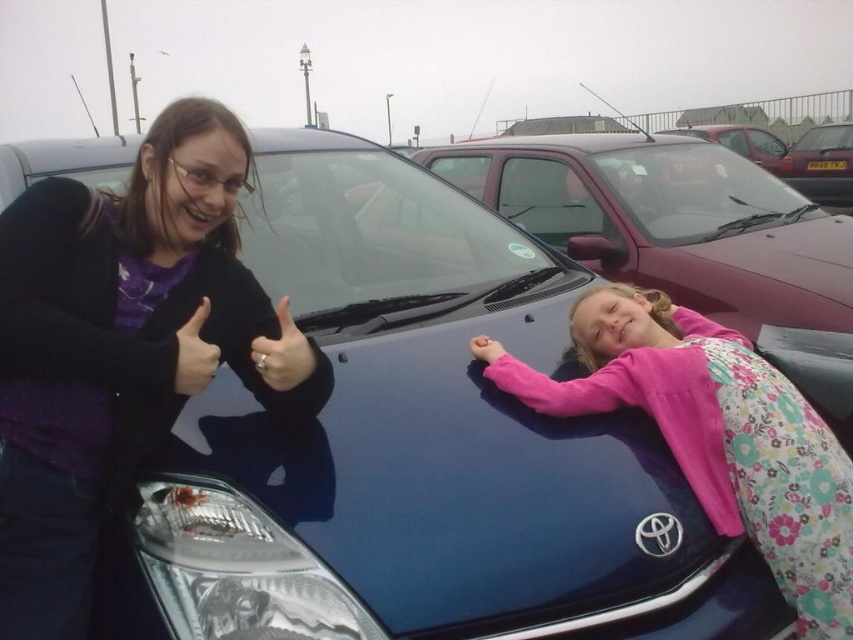
Who is lower down, matte black jacket at left or pink floral dress at center?

pink floral dress at center is below.

Can you confirm if matte black jacket at left is positioned below pink floral dress at center?

No, matte black jacket at left is not below pink floral dress at center.

This screenshot has height=640, width=853. Describe the element at coordinates (114, 346) in the screenshot. I see `matte black jacket at left` at that location.

Locate an element on the screen. matte black jacket at left is located at coordinates (114, 346).

Is matte black jacket at left bigger than metallic maroon car at right?

Actually, matte black jacket at left might be smaller than metallic maroon car at right.

Does point (103, 337) lie behind point (831, 138)?

No, it is not.

Identify the location of matte black jacket at left. The image size is (853, 640). (114, 346).

Is matte black jacket at left bigger than matte black ring at center?

Yes, matte black jacket at left is bigger than matte black ring at center.

Who is positioned more to the left, matte black jacket at left or matte black ring at center?

From the viewer's perspective, matte black jacket at left appears more on the left side.

Does point (268, 397) come in front of point (276, 314)?

Yes, it is.

Where is `matte black jacket at left`? The image size is (853, 640). matte black jacket at left is located at coordinates (114, 346).